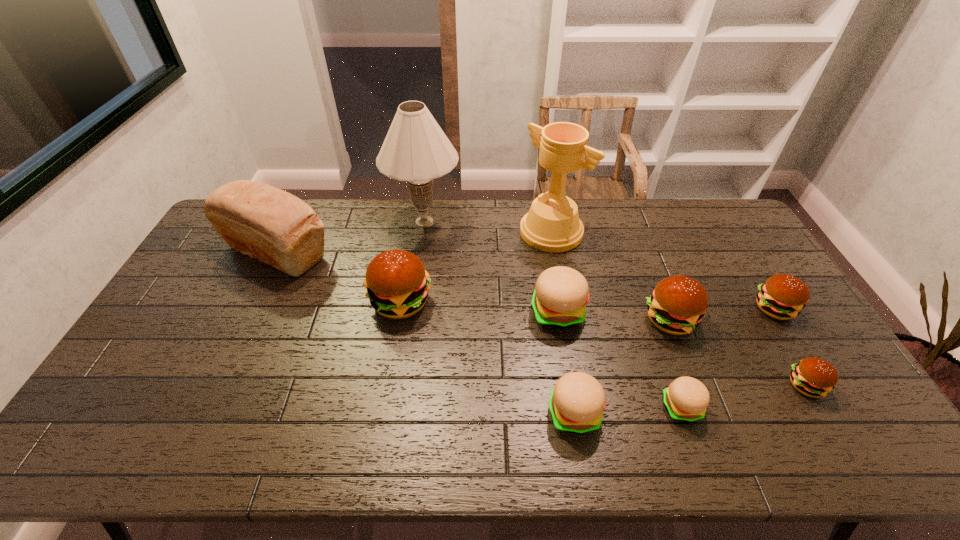
Where is `free space at the right edge of the desktop`? free space at the right edge of the desktop is located at coordinates (754, 313).

This screenshot has width=960, height=540. I want to click on free spot between the bread and the biggest brown hamburger, so (339, 277).

This screenshot has height=540, width=960. Identify the location of free space between the leftmost object and the second brown hamburger from left to right. (473, 286).

At what (x,y) coordinates should I click in order to perform the action: click on vacant point located between the rightmost beige hamburger and the third biggest brown hamburger. Please return your answer as a coordinate pair (x, y). The image size is (960, 540). Looking at the image, I should click on (728, 357).

Where is `free space between the rightmost beige hamburger and the award`? The height and width of the screenshot is (540, 960). free space between the rightmost beige hamburger and the award is located at coordinates (616, 320).

Find the location of a particular element. free space between the lampshade and the nearest brown hamburger is located at coordinates (615, 303).

Image resolution: width=960 pixels, height=540 pixels. Identify the location of free point between the second brown hamburger from left to right and the eighth shortest object. (473, 286).

Where is `free space between the third brown hamburger from right to left and the smallest brown hamburger`? Image resolution: width=960 pixels, height=540 pixels. free space between the third brown hamburger from right to left and the smallest brown hamburger is located at coordinates (738, 352).

Where is `free space between the beige award and the lampshade`? The height and width of the screenshot is (540, 960). free space between the beige award and the lampshade is located at coordinates (488, 227).

Identify which object is the seventh nearest to the leftmost hamburger. Please provide its 2D coordinates. Your answer should be formatted as a tuple, i.e. [(x, y)], where the tuple contains the x and y coordinates of a point satisfying the conditions above.

[(686, 399)]